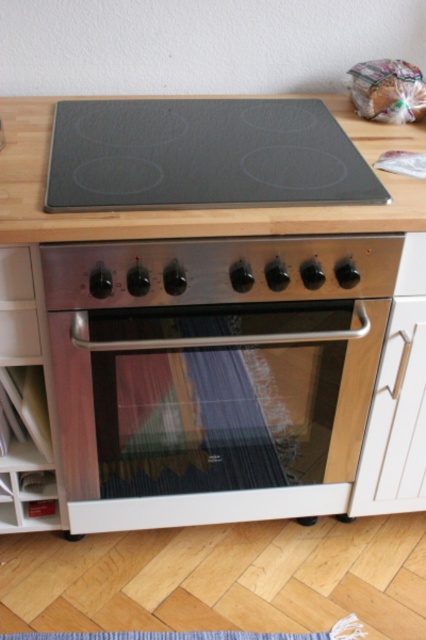
You are standing in the kitchen and need to locate the satin silver oven at center. According to the coordinates provided, where exactly is it positioned?

The satin silver oven at center is located at point coordinates of 0.652 in the x direction and 0.495 in the y direction.

You are organizing the kitchen and need to place a set of utensils. You have two drawers available, the white wood drawer at lower right and the white glossy drawer at lower left. Which drawer is positioned to the right side of the other?

The white wood drawer at lower right is to the right of the white glossy drawer at lower left.

You are a chef preparing to organize your kitchen tools. You have a large pot that requires 30 inches of space. You see the white wood drawer at lower right and the white glossy drawer at lower left. Can you place the pot between these two drawers?

The white wood drawer at lower right is 31.65 inches away from the white glossy drawer at lower left. Since the distance between them is greater than 30 inches, the pot can be placed between the white wood drawer at lower right and the white glossy drawer at lower left.